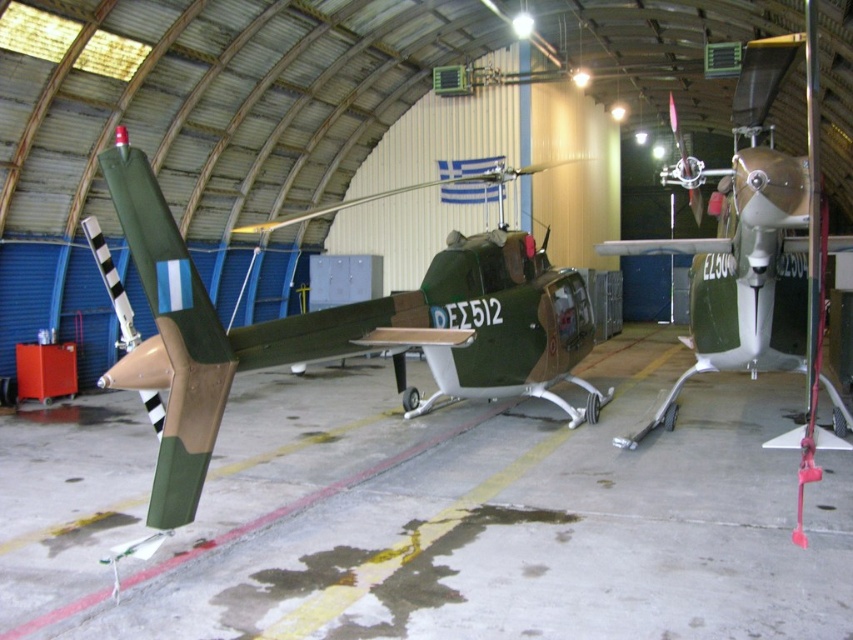
You are a maintenance worker in the hangar. You need to move the metallic gold propeller at right to the left side of the matte green helicopter at center. Is there enough space between the two objects to move it without touching anything else?

The matte green helicopter at center is thinner than the metallic gold propeller at right. Since the propeller is wider, moving it might require more space. However, the exact distance isn not provided, so it is uncertain if there is enough space to move it without touching anything else.

From the picture: You are a maintenance worker needing to reach the metallic gold propeller at right from the matte green helicopter at center. Given that your reach extends 1 meter, can you directly touch the propeller without moving?

The distance between the matte green helicopter at center and the metallic gold propeller at right is 6.65 meters. Since your reach is only 1 meter, you cannot directly touch the propeller without moving closer.

You are a drone operator planning to fly a drone through the hangar. The hangar has a height limit of 0.3 meters. You see the matte green helicopter at center. Is there enough vertical space between the drone and the hangar ceiling to fly safely?

The position of matte green helicopter at center is at point (x=314, y=324). The hangar ceiling height is 0.3 meters. Since the helicopter is positioned at 0.369 meters, which is higher than the ceiling limit of 0.3 meters, there is insufficient vertical space for the drone to fly safely without collision.